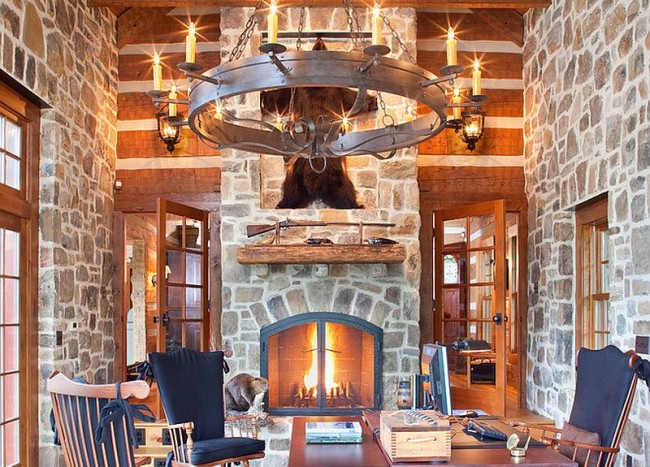
Find the location of `mounted bear on upper wall`. mounted bear on upper wall is located at coordinates pos(330,183).